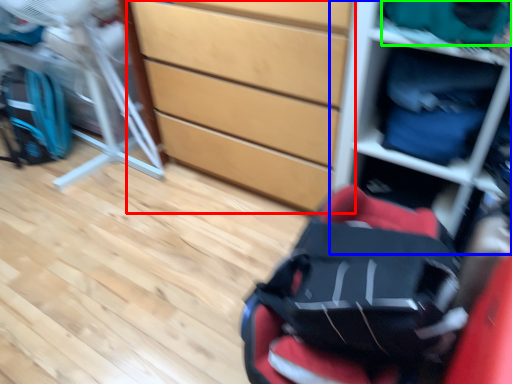
Question: Which object is the farthest from chest of drawers (highlighted by a red box)? Choose among these: shelf (highlighted by a blue box) or clothing (highlighted by a green box).

Choices:
 (A) shelf
 (B) clothing

Answer: (B)